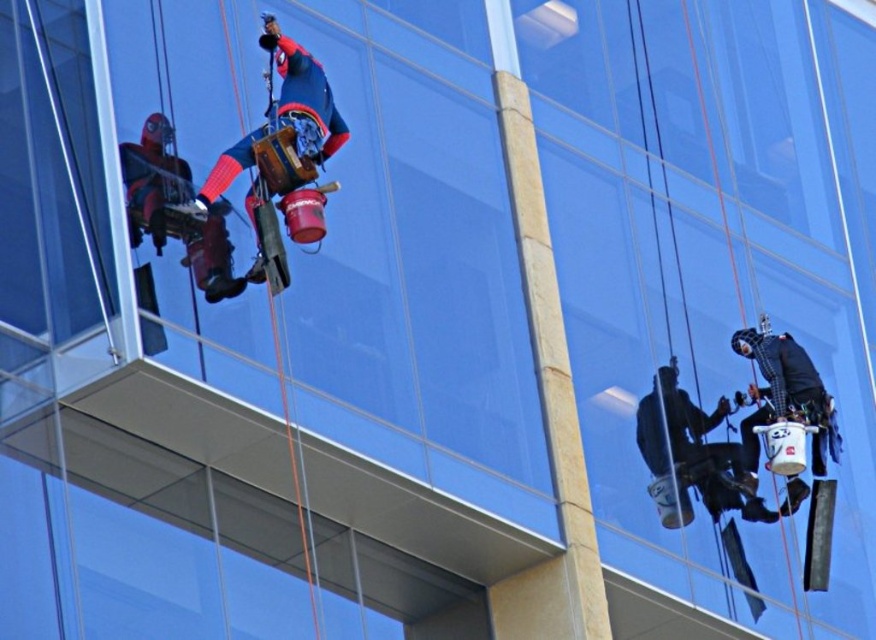
Question: Can you confirm if red fabric construction worker at upper left is smaller than black matte construction worker at lower right?

Choices:
 (A) yes
 (B) no

Answer: (A)

Question: Can you confirm if red fabric construction worker at upper left is positioned to the left of black matte construction worker at lower right?

Choices:
 (A) yes
 (B) no

Answer: (A)

Question: Which of the following is the closest to the observer?

Choices:
 (A) (795, 380)
 (B) (212, 168)

Answer: (B)

Question: Which object is closer to the camera taking this photo?

Choices:
 (A) black matte construction worker at lower right
 (B) red fabric construction worker at upper left

Answer: (B)

Question: Which point is closer to the camera?

Choices:
 (A) red fabric construction worker at upper left
 (B) black matte construction worker at lower right

Answer: (A)

Question: Can you confirm if red fabric construction worker at upper left is bigger than black matte construction worker at lower right?

Choices:
 (A) no
 (B) yes

Answer: (A)